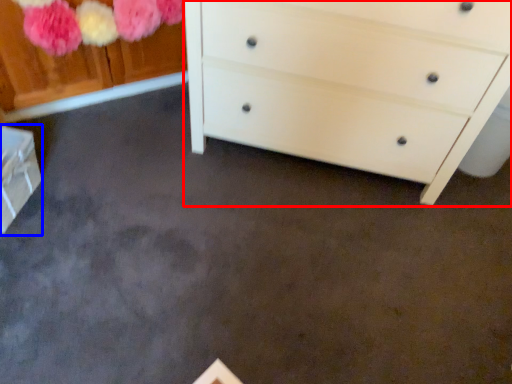
Question: Among these objects, which one is nearest to the camera, chest of drawers (highlighted by a red box) or cabinetry (highlighted by a blue box)?

Choices:
 (A) chest of drawers
 (B) cabinetry

Answer: (A)